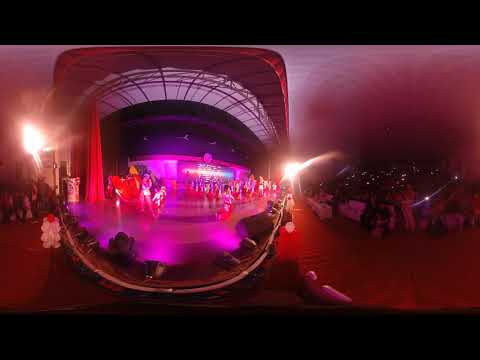
The image size is (480, 360). What are the coordinates of `stage` in the screenshot? It's located at (171, 237).